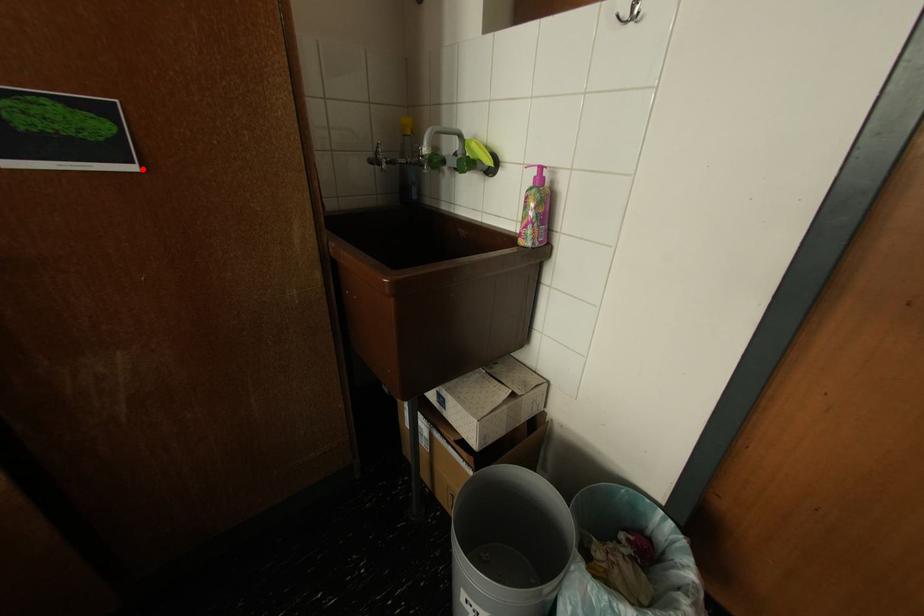
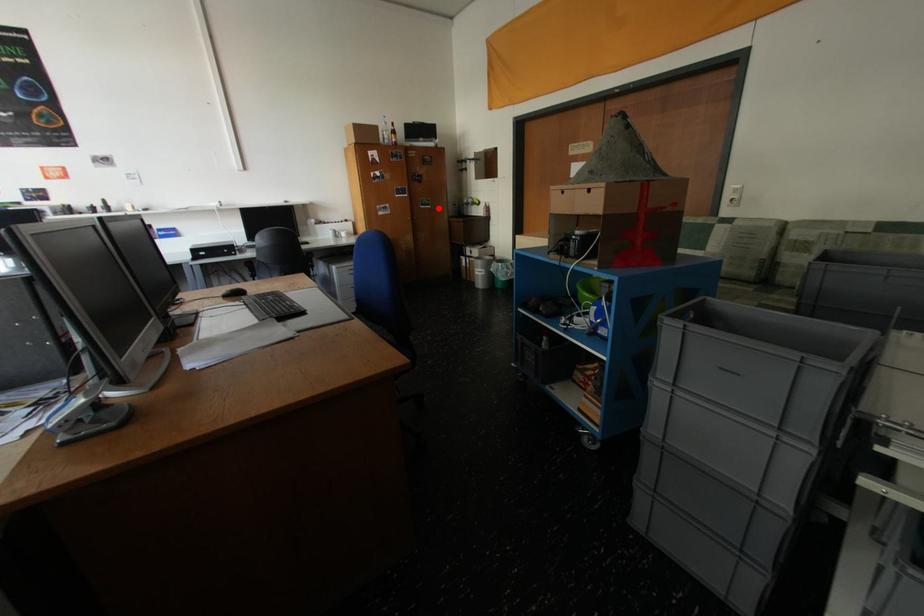
I am providing you with two images of the same scene from different viewpoints. A red point is marked on the first image and another point is marked on the second image. Is the marked point in image1 the same physical position as the marked point in image2?

Yes